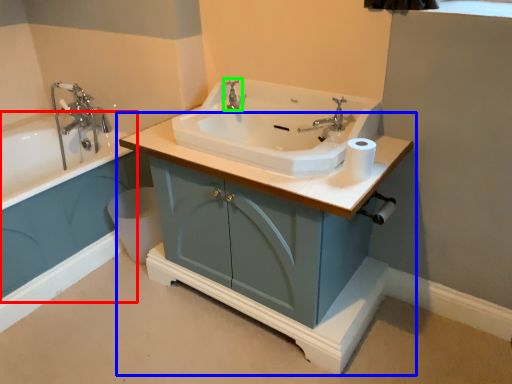
Question: Based on their relative distances, which object is farther from bath (highlighted by a red box)? Choose from bathroom cabinet (highlighted by a blue box) and tap (highlighted by a green box).

Choices:
 (A) bathroom cabinet
 (B) tap

Answer: (B)